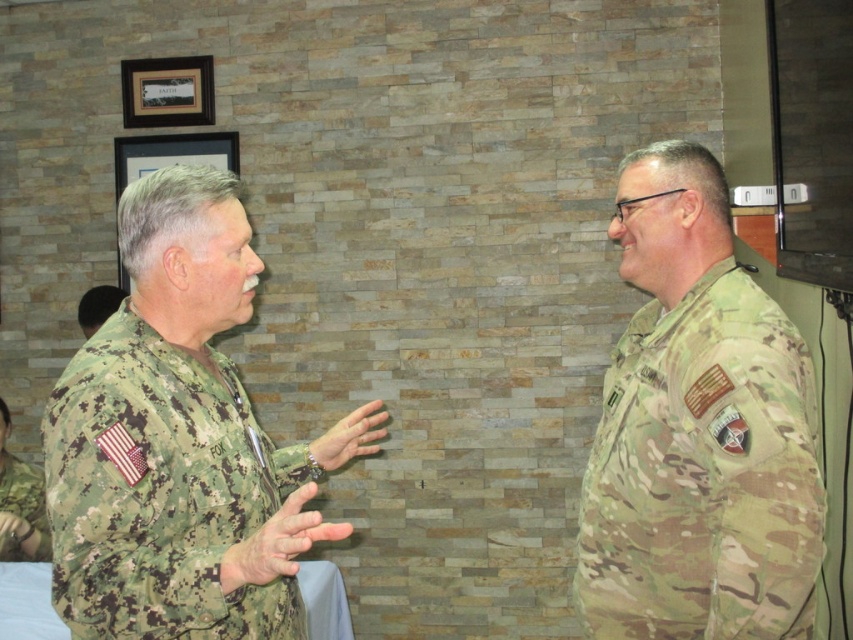
Question: Can you confirm if camouflage uniform at left is wider than camouflage uniform at center?

Choices:
 (A) no
 (B) yes

Answer: (B)

Question: Among these points, which one is farthest from the camera?

Choices:
 (A) (3, 547)
 (B) (128, 369)

Answer: (A)

Question: Is digital camouflage uniform at left above camouflage uniform at left?

Choices:
 (A) yes
 (B) no

Answer: (A)

Question: Considering the relative positions of digital camouflage uniform at left and camouflage uniform at center in the image provided, where is digital camouflage uniform at left located with respect to camouflage uniform at center?

Choices:
 (A) below
 (B) above

Answer: (A)

Question: Among these points, which one is nearest to the camera?

Choices:
 (A) (717, 422)
 (B) (236, 508)

Answer: (B)

Question: Considering the real-world distances, which object is farthest from the camouflage uniform at center?

Choices:
 (A) camouflage fabric uniform at right
 (B) digital camouflage uniform at left
 (C) camouflage uniform at left

Answer: (A)